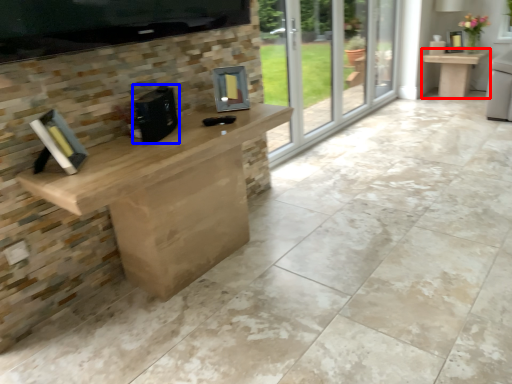
Question: Which object appears farthest to the camera in this image, table (highlighted by a red box) or appliance (highlighted by a blue box)?

Choices:
 (A) table
 (B) appliance

Answer: (A)